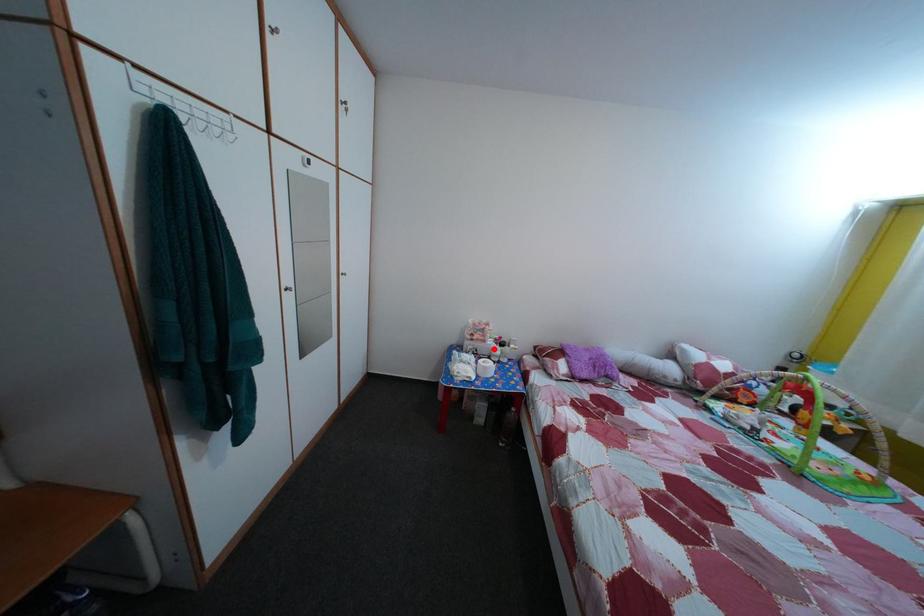
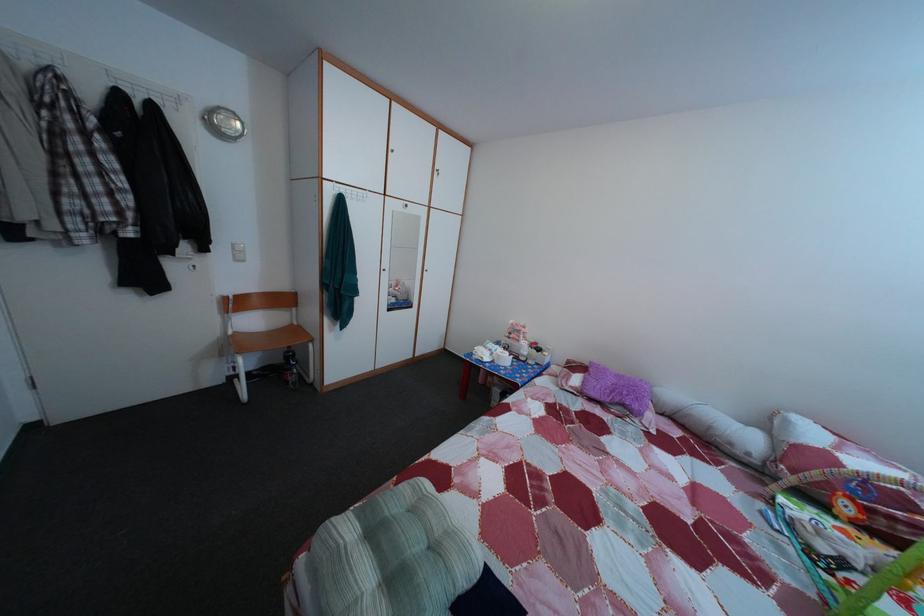
Locate, in the second image, the point that corresponds to the highlighted location in the first image.

(528, 349)